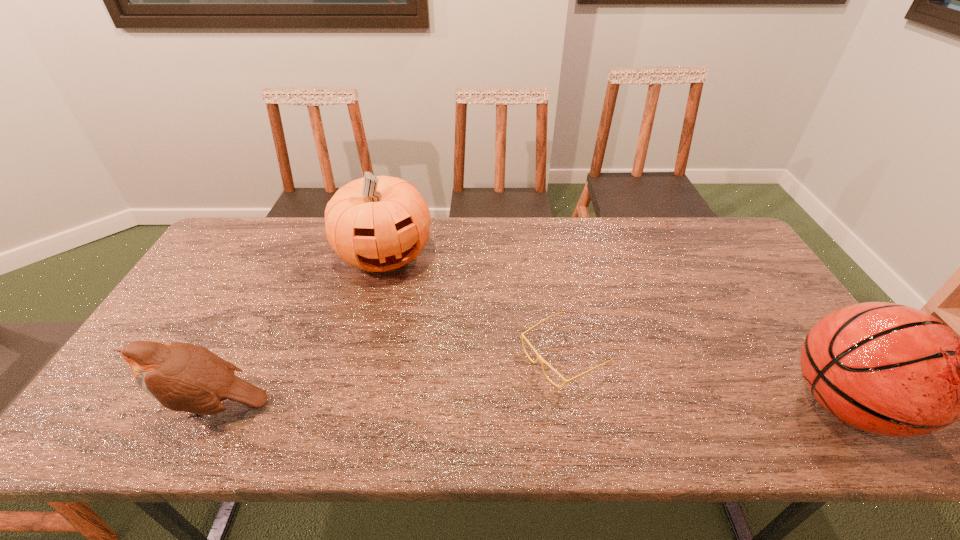
Find the location of a particular element. blank region between the pumpkin and the bird is located at coordinates (299, 330).

In order to click on vacant region between the third object from right to left and the shortest object in this screenshot , I will do `click(474, 305)`.

Locate an element on the screen. The height and width of the screenshot is (540, 960). vacant space in between the basketball and the leftmost object is located at coordinates 530,404.

You are a GUI agent. You are given a task and a screenshot of the screen. Output one action in this format:
    pyautogui.click(x=<x>, y=<y>)
    Task: Click on the unoccupied area between the shortest object and the bird
    Image resolution: width=960 pixels, height=540 pixels.
    Given the screenshot: What is the action you would take?
    pyautogui.click(x=389, y=380)

Find the location of a particular element. Image resolution: width=960 pixels, height=540 pixels. vacant area that lies between the leftmost object and the shortest object is located at coordinates (389, 380).

The height and width of the screenshot is (540, 960). What are the coordinates of `empty space between the basketball and the farthest object` in the screenshot? It's located at (614, 329).

Find the location of a particular element. The height and width of the screenshot is (540, 960). free space between the spectacles and the basketball is located at coordinates (705, 380).

Identify the location of free spot between the pumpkin and the spectacles. tap(474, 305).

Where is `object that can be found as the second closest to the third tallest object`? object that can be found as the second closest to the third tallest object is located at coordinates (539, 357).

Identify the location of object that is the closest to the farthest object. This screenshot has height=540, width=960. click(x=539, y=357).